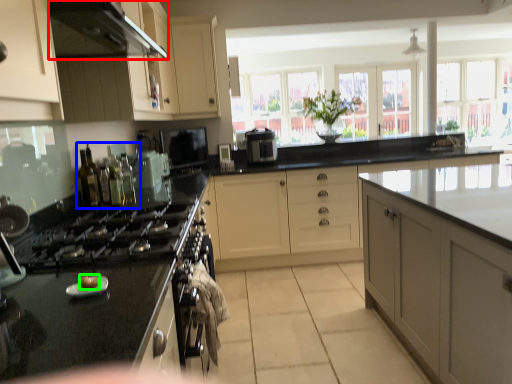
Question: Estimate the real-world distances between objects in this image. Which object is closer to exhaust hood (highlighted by a red box), bottle (highlighted by a blue box) or food (highlighted by a green box)?

Choices:
 (A) bottle
 (B) food

Answer: (A)